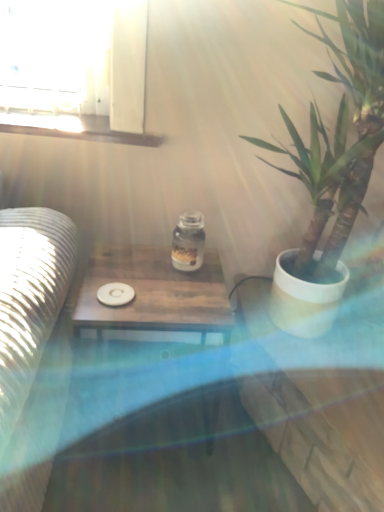
At what (x,y) coordinates should I click in order to perform the action: click on blank space situated above wooden table at center (from a real-world perspective). Please return your answer as a coordinate pair (x, y). Looking at the image, I should click on (156, 290).